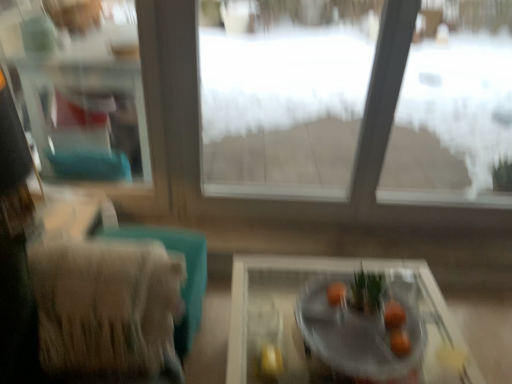
Question: Looking at their shapes, would you say clear glass window frame at upper left is wider or thinner than smooth orange fruit at center?

Choices:
 (A) thin
 (B) wide

Answer: (A)

Question: Considering the positions of clear glass window frame at upper left and smooth orange fruit at center in the image, is clear glass window frame at upper left bigger or smaller than smooth orange fruit at center?

Choices:
 (A) big
 (B) small

Answer: (A)

Question: Considering the real-world distances, which object is farthest from the smooth orange fruit at center?

Choices:
 (A) orange matte at center
 (B) clear glass window frame at upper left
 (C) beige fabric armchair at left
 (D) clear glass tray at center
 (E) transparent glass window at center

Answer: (B)

Question: Which object is positioned closest to the orange matte at center?

Choices:
 (A) beige fabric armchair at left
 (B) clear glass window frame at upper left
 (C) clear glass tray at center
 (D) transparent glass window at center
 (E) smooth orange fruit at center

Answer: (E)